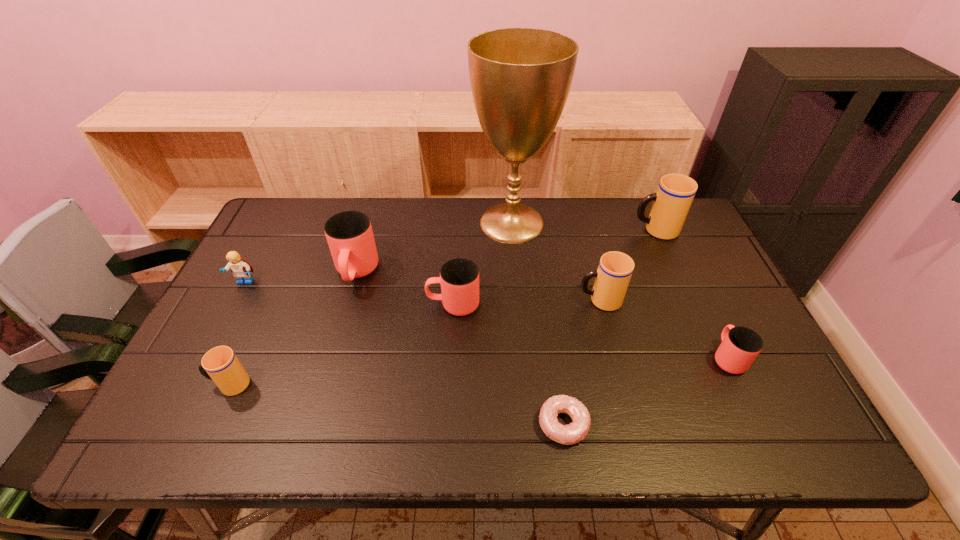
Locate an element on the screen. free space located 0.090m on the handle side of the smallest pink cup is located at coordinates (706, 313).

You are a GUI agent. You are given a task and a screenshot of the screen. Output one action in this format:
    pyautogui.click(x=<x>, y=<y>)
    Task: Click on the blank space located 0.190m on the back of the nearest object
    The image size is (960, 540).
    Given the screenshot: What is the action you would take?
    pyautogui.click(x=551, y=334)

The image size is (960, 540). Find the location of `trophy cup situated at the far edge`. trophy cup situated at the far edge is located at coordinates (520, 78).

This screenshot has height=540, width=960. I want to click on cup situated at the far edge, so click(671, 203).

The image size is (960, 540). Identify the location of object located at the near edge. (576, 431).

Find the location of a particular element. The height and width of the screenshot is (540, 960). Lego located at the left edge is located at coordinates (241, 269).

The width and height of the screenshot is (960, 540). What are the coordinates of `cup that is at the left edge` in the screenshot? It's located at (220, 364).

Locate an element on the screen. This screenshot has height=540, width=960. object at the far right corner is located at coordinates (671, 203).

In the image, there is a desktop. Where is `vacant space at the far edge`? The width and height of the screenshot is (960, 540). vacant space at the far edge is located at coordinates pos(459,218).

Locate an element on the screen. Image resolution: width=960 pixels, height=540 pixels. vacant space at the near edge of the desktop is located at coordinates (451, 414).